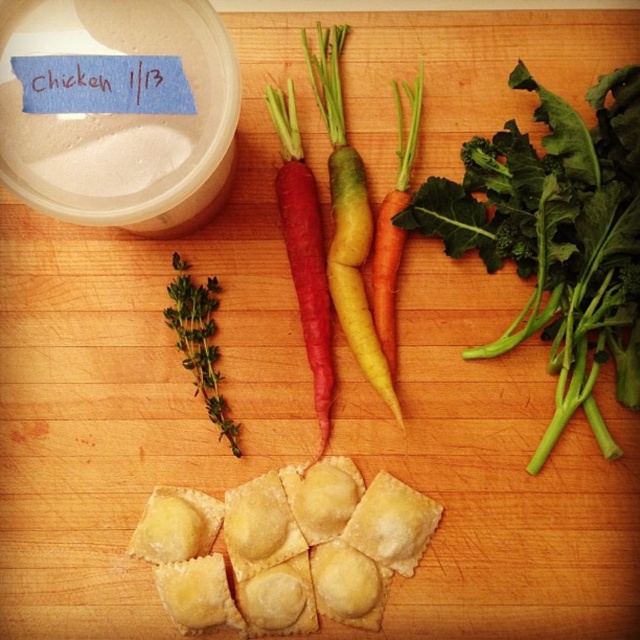
You are a chef preparing a dish and need to place the golden doughy ravioli at center between two carrots. Can you fit them in the space between the carrots?

The golden doughy ravioli at center are 1.17 meters apart. Since the distance between the carrots is 1.17 meters, the ravioli can fit between them if their combined width is less than or equal to the space available. However, without knowing the exact size of the ravioli, it is impossible to determine if they will fit.

You are a chef preparing a dish and need to arrange carrots on a plate. You have the red matte carrot at center and the orange matte carrot at center. If you want to place them side by side so both are fully visible, which carrot should you move forward?

The orange matte carrot at center is behind the red matte carrot at center, so to make both fully visible, move the orange matte carrot at center forward so it is in front of the red matte carrot at center.

You are preparing a salad and need to know which vegetable is wider. You have a green leafy vegetable at upper right and a yellow matte carrot at center. Which one is wider?

The green leafy vegetable at upper right is wider than the yellow matte carrot at center.